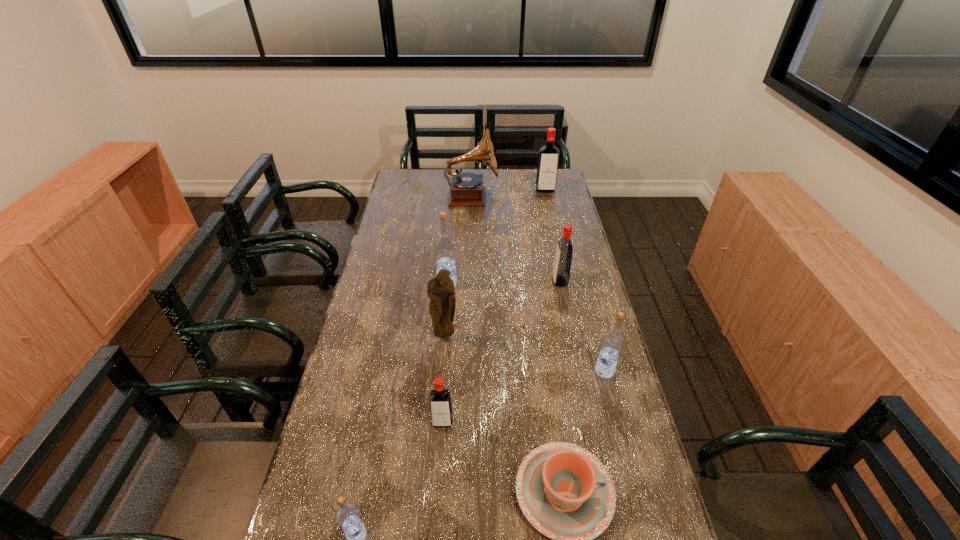
Image resolution: width=960 pixels, height=540 pixels. Find the location of `phonograph_record that is at the far edge`. phonograph_record that is at the far edge is located at coordinates (466, 189).

Locate an element on the screen. This screenshot has width=960, height=540. vodka that is at the far edge is located at coordinates (548, 158).

This screenshot has width=960, height=540. I want to click on object that is at the far right corner, so click(x=548, y=158).

Locate an element on the screen. This screenshot has width=960, height=540. free space at the left edge of the desktop is located at coordinates (321, 532).

Locate an element on the screen. free space at the right edge of the desktop is located at coordinates (616, 472).

The height and width of the screenshot is (540, 960). Identify the location of vacant space in between the phonograph_record and the farthest blue vodka. (460, 240).

Find the location of a particular element. vacant area between the second farthest red vodka and the figurine is located at coordinates (502, 309).

The image size is (960, 540). I want to click on empty space between the biggest red vodka and the second smallest red vodka, so point(553,236).

At what (x,y) coordinates should I click in order to perform the action: click on free spot between the biggest blue vodka and the phonograph_record. Please return your answer as a coordinate pair (x, y). This screenshot has height=540, width=960. Looking at the image, I should click on (460, 240).

The height and width of the screenshot is (540, 960). Identify the location of vacant region between the phonograph_record and the farthest vodka. (509, 194).